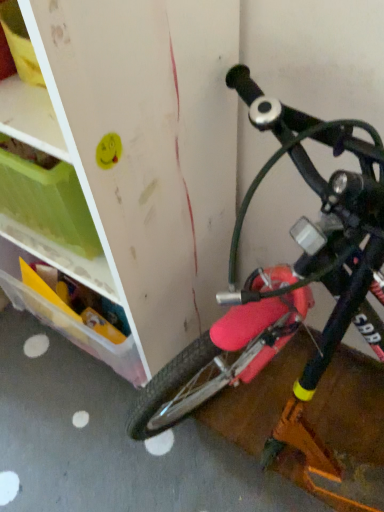
In order to face pink matte bicycle at right, should I rotate leftwards or rightwards?

Rotate your view right by about 17.394°.

What do you see at coordinates (286, 271) in the screenshot? This screenshot has height=512, width=384. I see `pink matte bicycle at right` at bounding box center [286, 271].

You are a GUI agent. You are given a task and a screenshot of the screen. Output one action in this format:
    pyautogui.click(x=<x>, y=<y>)
    Task: Click on the pink matte bicycle at right
    
    Given the screenshot: What is the action you would take?
    pyautogui.click(x=286, y=271)

In order to face translucent plastic storage box at left, should I rotate leftwards or rightwards?

You should rotate left by 15.309 degrees.

The height and width of the screenshot is (512, 384). What do you see at coordinates (66, 319) in the screenshot? I see `translucent plastic storage box at left` at bounding box center [66, 319].

Identify the location of translucent plastic storage box at left. (66, 319).

In order to click on pink matte bicycle at right in this screenshot , I will do `click(286, 271)`.

Between translucent plastic storage box at left and pink matte bicycle at right, which one appears on the right side from the viewer's perspective?

From the viewer's perspective, pink matte bicycle at right appears more on the right side.

Is translucent plastic storage box at left in front of or behind pink matte bicycle at right in the image?

In the image, translucent plastic storage box at left appears behind pink matte bicycle at right.

Which point is more forward, [132,381] or [282,113]?

The point [282,113] is more forward.

From the image's perspective, is translucent plastic storage box at left located above or below pink matte bicycle at right?

From the image's perspective, translucent plastic storage box at left appears above pink matte bicycle at right.

From a real-world perspective, which is physically below, translucent plastic storage box at left or pink matte bicycle at right?

translucent plastic storage box at left, from a real-world perspective.

Considering the relative sizes of translucent plastic storage box at left and pink matte bicycle at right in the image provided, is translucent plastic storage box at left thinner than pink matte bicycle at right?

Yes, translucent plastic storage box at left is thinner than pink matte bicycle at right.

Who is shorter, translucent plastic storage box at left or pink matte bicycle at right?

translucent plastic storage box at left.

Considering the relative sizes of translucent plastic storage box at left and pink matte bicycle at right in the image provided, is translucent plastic storage box at left smaller than pink matte bicycle at right?

Yes.

Do you think translucent plastic storage box at left is within pink matte bicycle at right, or outside of it?

translucent plastic storage box at left cannot be found inside pink matte bicycle at right.

Based on the photo, is translucent plastic storage box at left directly adjacent to pink matte bicycle at right?

No, translucent plastic storage box at left is not with pink matte bicycle at right.

Could you tell me if translucent plastic storage box at left is facing pink matte bicycle at right?

No, translucent plastic storage box at left is not aimed at pink matte bicycle at right.

Measure the distance between translucent plastic storage box at left and pink matte bicycle at right.

The distance of translucent plastic storage box at left from pink matte bicycle at right is 15.56 inches.

The width and height of the screenshot is (384, 512). Identify the location of storage box above the pink matte bicycle at right (from the image's perspective). (66, 319).

Between pink matte bicycle at right and translucent plastic storage box at left, which one appears on the right side from the viewer's perspective?

pink matte bicycle at right.

Between pink matte bicycle at right and translucent plastic storage box at left, which one is positioned in front?

pink matte bicycle at right.

Looking at this image, which point is more forward, (x=287, y=292) or (x=81, y=335)?

Positioned in front is point (x=287, y=292).

From the image's perspective, is pink matte bicycle at right under translucent plastic storage box at left?

Yes, from the image's perspective, pink matte bicycle at right is below translucent plastic storage box at left.

From a real-world perspective, which is physically below, pink matte bicycle at right or translucent plastic storage box at left?

translucent plastic storage box at left is physically lower.

In terms of width, does pink matte bicycle at right look wider or thinner when compared to translucent plastic storage box at left?

In the image, pink matte bicycle at right appears to be wider than translucent plastic storage box at left.

Which of these two, pink matte bicycle at right or translucent plastic storage box at left, stands taller?

With more height is pink matte bicycle at right.

Considering the relative sizes of pink matte bicycle at right and translucent plastic storage box at left in the image provided, is pink matte bicycle at right bigger than translucent plastic storage box at left?

Yes.

Which is correct: pink matte bicycle at right is inside translucent plastic storage box at left, or outside of it?

The correct answer is: outside.

Are pink matte bicycle at right and translucent plastic storage box at left making contact?

pink matte bicycle at right is not next to translucent plastic storage box at left, and they're not touching.

Is translucent plastic storage box at left at the back of pink matte bicycle at right?

pink matte bicycle at right is not turned away from translucent plastic storage box at left.

Locate an element on the screen. bicycle that is above the translucent plastic storage box at left (from a real-world perspective) is located at coordinates (286, 271).

Identify the location of bicycle on the right side of translucent plastic storage box at left. The height and width of the screenshot is (512, 384). (286, 271).

Find the location of a particular element. bicycle in front of the translucent plastic storage box at left is located at coordinates (286, 271).